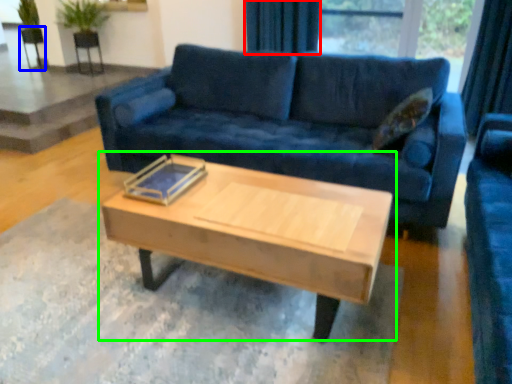
Question: Which object is the closest to the curtain (highlighted by a red box)? Choose among these: armchair (highlighted by a blue box) or coffee table (highlighted by a green box).

Choices:
 (A) armchair
 (B) coffee table

Answer: (B)